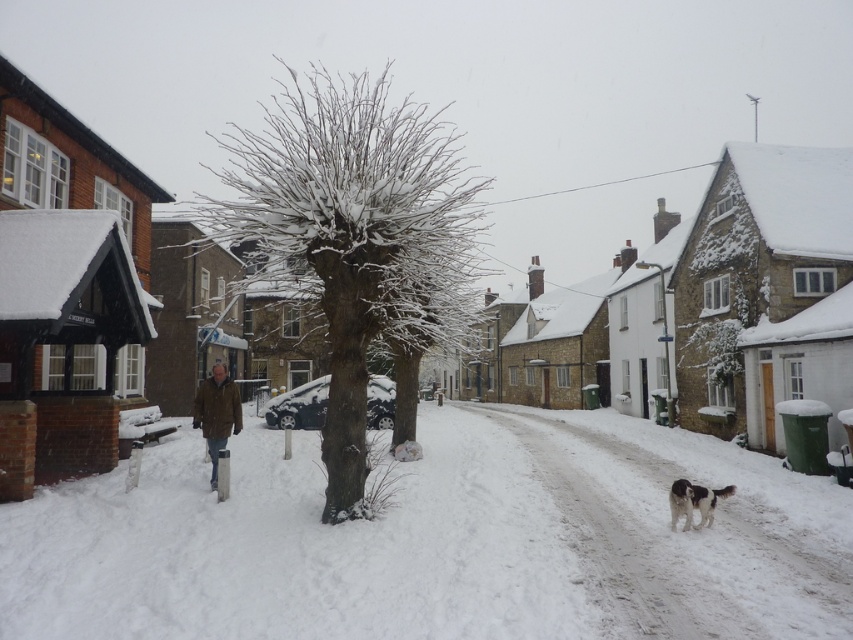
Can you confirm if white fluffy snow at center is positioned to the right of white fluffy dog at lower right?

In fact, white fluffy snow at center is to the left of white fluffy dog at lower right.

Who is positioned more to the left, white fluffy snow at center or white fluffy dog at lower right?

From the viewer's perspective, white fluffy snow at center appears more on the left side.

Does point (250, 508) come farther from viewer compared to point (712, 490)?

Yes, point (250, 508) is farther from viewer.

I want to click on white fluffy snow at center, so click(x=436, y=541).

Who is lower down, white fluffy snow at center or snow-covered bark tree at center?

Positioned lower is white fluffy snow at center.

The width and height of the screenshot is (853, 640). What do you see at coordinates (436, 541) in the screenshot? I see `white fluffy snow at center` at bounding box center [436, 541].

Locate an element on the screen. white fluffy snow at center is located at coordinates [x=436, y=541].

Does snow-covered bark tree at center have a lesser width compared to white fluffy dog at lower right?

No, snow-covered bark tree at center is not thinner than white fluffy dog at lower right.

Does snow-covered bark tree at center appear on the left side of white fluffy dog at lower right?

Yes, snow-covered bark tree at center is to the left of white fluffy dog at lower right.

Is point (395, 308) positioned after point (679, 483)?

Yes, it is.

Locate an element on the screen. Image resolution: width=853 pixels, height=640 pixels. snow-covered bark tree at center is located at coordinates (354, 234).